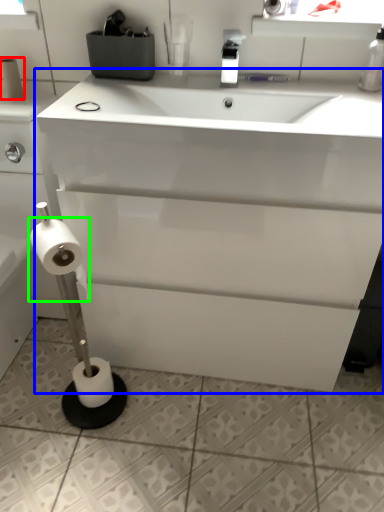
Question: Which object is positioned farthest from toilet paper (highlighted by a red box)? Select from bathroom cabinet (highlighted by a blue box) and toilet paper (highlighted by a green box).

Choices:
 (A) bathroom cabinet
 (B) toilet paper

Answer: (A)